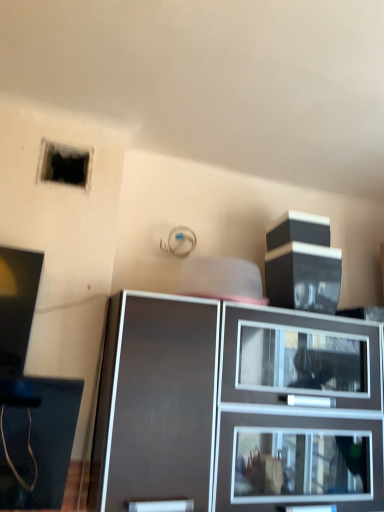
Measure the distance between point (x=45, y=163) and camera.

They are 4.63 feet apart.

Find the location of a particular element. This screenshot has width=384, height=512. black matte hole at upper left is located at coordinates (65, 165).

What do you see at coordinates (65, 165) in the screenshot?
I see `black matte hole at upper left` at bounding box center [65, 165].

This screenshot has height=512, width=384. Find the location of `matte black cabinet at center`. matte black cabinet at center is located at coordinates (236, 408).

What do you see at coordinates (236, 408) in the screenshot? Image resolution: width=384 pixels, height=512 pixels. I see `matte black cabinet at center` at bounding box center [236, 408].

The image size is (384, 512). Identify the location of black matte hole at upper left. (65, 165).

Considering the positions of objects black matte hole at upper left and matte black cabinet at center in the image provided, who is more to the right, black matte hole at upper left or matte black cabinet at center?

matte black cabinet at center is more to the right.

Considering the positions of objects black matte hole at upper left and matte black cabinet at center in the image provided, who is in front, black matte hole at upper left or matte black cabinet at center?

matte black cabinet at center is in front.

Is point (87, 182) positioned in front of point (163, 468)?

No, it is not.

From the image's perspective, does black matte hole at upper left appear higher than matte black cabinet at center?

Yes, from the image's perspective, black matte hole at upper left is above matte black cabinet at center.

From a real-world perspective, is black matte hole at upper left over matte black cabinet at center?

Yes.

Which object is wider, black matte hole at upper left or matte black cabinet at center?

Wider between the two is matte black cabinet at center.

Considering the relative sizes of black matte hole at upper left and matte black cabinet at center in the image provided, is black matte hole at upper left shorter than matte black cabinet at center?

Indeed, black matte hole at upper left has a lesser height compared to matte black cabinet at center.

Considering the sizes of objects black matte hole at upper left and matte black cabinet at center in the image provided, who is bigger, black matte hole at upper left or matte black cabinet at center?

matte black cabinet at center.

Can we say black matte hole at upper left lies outside matte black cabinet at center?

Yes, black matte hole at upper left is located beyond the bounds of matte black cabinet at center.

Is black matte hole at upper left touching matte black cabinet at center?

black matte hole at upper left is not next to matte black cabinet at center, and they're not touching.

In the scene shown: Is black matte hole at upper left aimed at matte black cabinet at center?

No, black matte hole at upper left is not facing towards matte black cabinet at center.

Can you tell me how much black matte hole at upper left and matte black cabinet at center differ in facing direction?

The facing directions of black matte hole at upper left and matte black cabinet at center are 2.86 degrees apart.

Find the location of a particular element. The image size is (384, 512). cabinetry in front of the black matte hole at upper left is located at coordinates (236, 408).

Which is more to the left, matte black cabinet at center or black matte hole at upper left?

From the viewer's perspective, black matte hole at upper left appears more on the left side.

Is matte black cabinet at center closer to camera compared to black matte hole at upper left?

Yes, matte black cabinet at center is in front of black matte hole at upper left.

Which is closer, (x=364, y=398) or (x=53, y=177)?

The point (x=364, y=398) is closer to the camera.

From the image's perspective, which one is positioned higher, matte black cabinet at center or black matte hole at upper left?

From the image's view, black matte hole at upper left is above.

From a real-world perspective, is matte black cabinet at center on black matte hole at upper left?

No, from a real-world perspective, matte black cabinet at center is not over black matte hole at upper left

Which object is thinner, matte black cabinet at center or black matte hole at upper left?

black matte hole at upper left.

Is matte black cabinet at center taller or shorter than black matte hole at upper left?

In the image, matte black cabinet at center appears to be taller than black matte hole at upper left.

Considering the sizes of objects matte black cabinet at center and black matte hole at upper left in the image provided, who is smaller, matte black cabinet at center or black matte hole at upper left?

black matte hole at upper left is smaller.

Is matte black cabinet at center spatially inside black matte hole at upper left, or outside of it?

matte black cabinet at center is located beyond the bounds of black matte hole at upper left.

Would you say matte black cabinet at center is a long distance from black matte hole at upper left?

They are positioned close to each other.

Is matte black cabinet at center oriented away from black matte hole at upper left?

matte black cabinet at center does not have its back to black matte hole at upper left.

Consider the image. What's the angular difference between matte black cabinet at center and black matte hole at upper left's facing directions?

matte black cabinet at center and black matte hole at upper left are facing 2.86 degrees away from each other.

The height and width of the screenshot is (512, 384). I want to click on cabinetry on the right side of black matte hole at upper left, so click(236, 408).

Image resolution: width=384 pixels, height=512 pixels. Find the location of `cabinetry below the black matte hole at upper left (from the image's perspective)`. cabinetry below the black matte hole at upper left (from the image's perspective) is located at coordinates (236, 408).

In order to click on hole located above the matte black cabinet at center (from a real-world perspective) in this screenshot , I will do `click(65, 165)`.